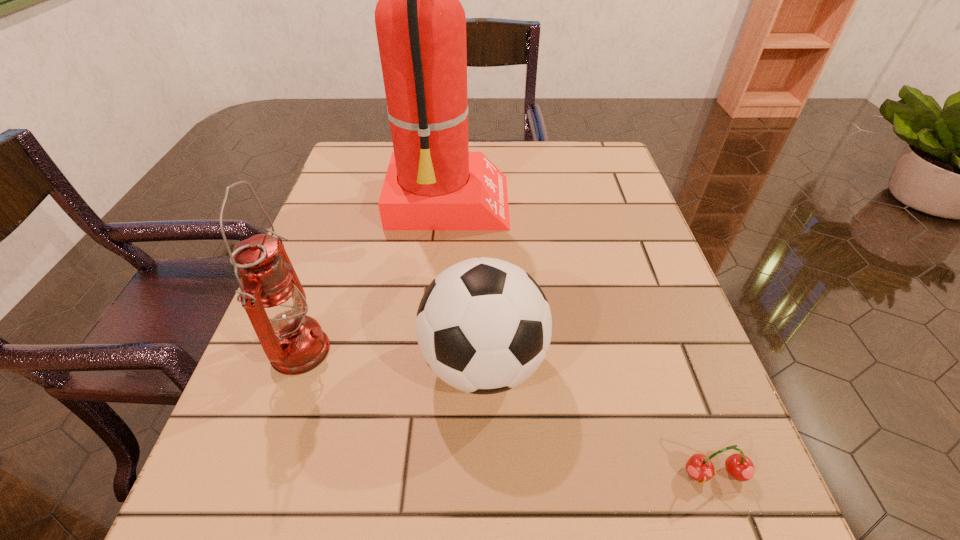
In the image, there is a desktop. Identify the location of vacant space at the near left corner. The height and width of the screenshot is (540, 960). (222, 503).

In the image, there is a desktop. In order to click on vacant area at the far right corner in this screenshot , I will do `click(624, 172)`.

Where is `unoccupied position between the rightmost object and the third tallest object`? unoccupied position between the rightmost object and the third tallest object is located at coordinates (599, 418).

The height and width of the screenshot is (540, 960). In order to click on vacant space in between the oil lamp and the third tallest object in this screenshot , I will do `click(392, 357)`.

Find the location of a particular element. The image size is (960, 540). free space between the rightmost object and the soccer ball is located at coordinates (599, 418).

I want to click on vacant area that lies between the farthest object and the leftmost object, so click(x=374, y=279).

At what (x,y) coordinates should I click in order to perform the action: click on vacant point located between the leftmost object and the nearest object. Please return your answer as a coordinate pair (x, y). Looking at the image, I should click on (508, 413).

Where is `empty space between the nearest object and the fire extinguisher`? The width and height of the screenshot is (960, 540). empty space between the nearest object and the fire extinguisher is located at coordinates (582, 340).

At what (x,y) coordinates should I click in order to perform the action: click on object that is the second nearest to the rightmost object. Please return your answer as a coordinate pair (x, y). The height and width of the screenshot is (540, 960). Looking at the image, I should click on click(433, 182).

The width and height of the screenshot is (960, 540). I want to click on object that ranks as the closest to the leftmost object, so click(483, 326).